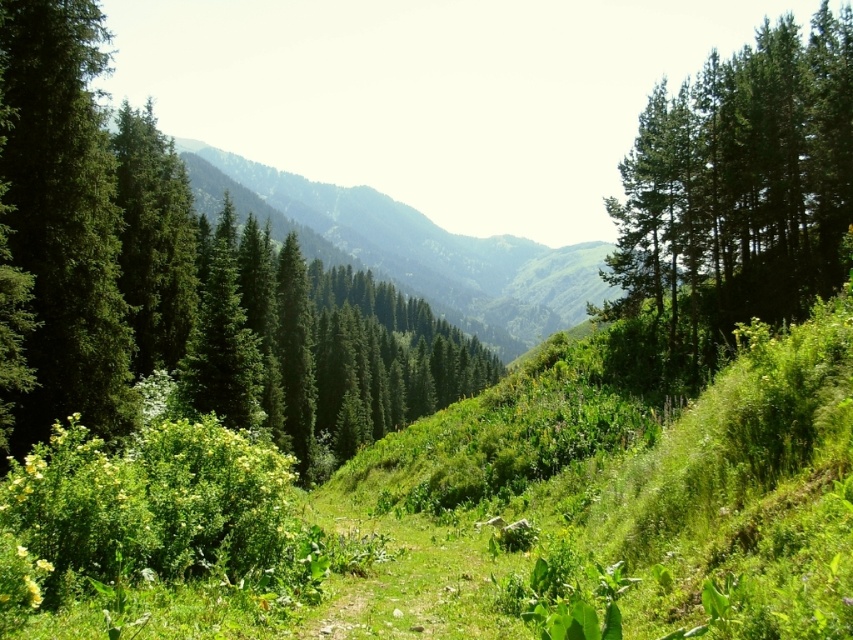
Does green matte tree at upper right lie in front of green textured mountain at center?

Yes, it is in front of green textured mountain at center.

Between point (611, 209) and point (503, 280), which one is positioned in front?

Point (611, 209) is more forward.

Where is `green matte tree at upper right`? The height and width of the screenshot is (640, 853). green matte tree at upper right is located at coordinates (735, 193).

Image resolution: width=853 pixels, height=640 pixels. In order to click on green matte tree at center in this screenshot , I will do `click(178, 280)`.

The image size is (853, 640). Identify the location of green matte tree at center. (178, 280).

Is point (706, 216) positioned after point (42, 211)?

Yes, point (706, 216) is behind point (42, 211).

Is green matte tree at upper right to the right of green matte tree at left from the viewer's perspective?

Correct, you'll find green matte tree at upper right to the right of green matte tree at left.

Find the location of a particular element. green matte tree at upper right is located at coordinates (735, 193).

The height and width of the screenshot is (640, 853). Identify the location of green matte tree at upper right. (735, 193).